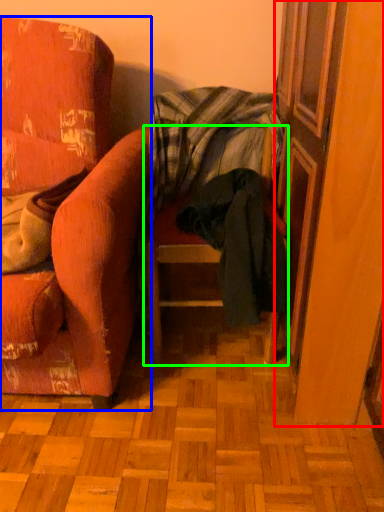
Question: Estimate the real-world distances between objects in this image. Which object is closer to screen door (highlighted by a red box), chair (highlighted by a blue box) or chair (highlighted by a green box)?

Choices:
 (A) chair
 (B) chair

Answer: (B)